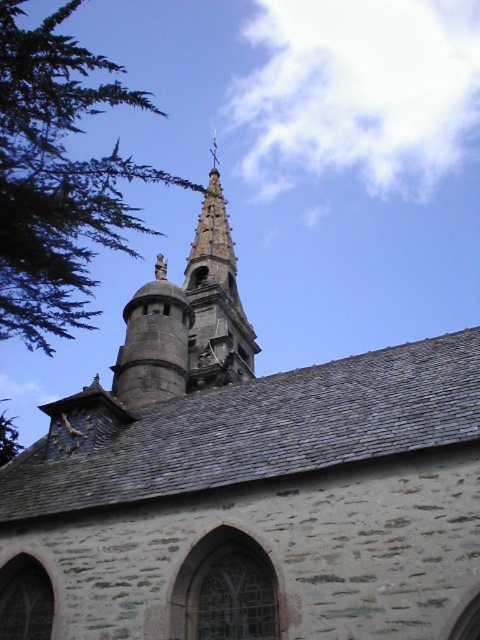
You are an architect analyzing the church layout. You need to determine if the green leafy tree at upper left can be safely trimmed to fit within the space allocated for the smooth stone bell tower at upper center. Based on their sizes, what would you recommend?

The green leafy tree at upper left has a larger width than the smooth stone bell tower at upper center. Therefore, trimming the tree to match the bell tower size would be necessary to ensure it fits within the allocated space.

You are standing in front of the historic stone church and looking up. Which direction should you look to see the green leafy tree at upper left?

The green leafy tree at upper left is located at point (58, 177), so you should look to the upper left direction to see it.

You are standing in front of the historic stone church and notice the green leafy tree at upper left and the smooth stone bell tower at upper center. Which object is positioned more to the left side of the scene?

The green leafy tree at upper left is positioned more to the left side of the scene compared to the smooth stone bell tower at upper center, as it is located to the left of the bell tower.